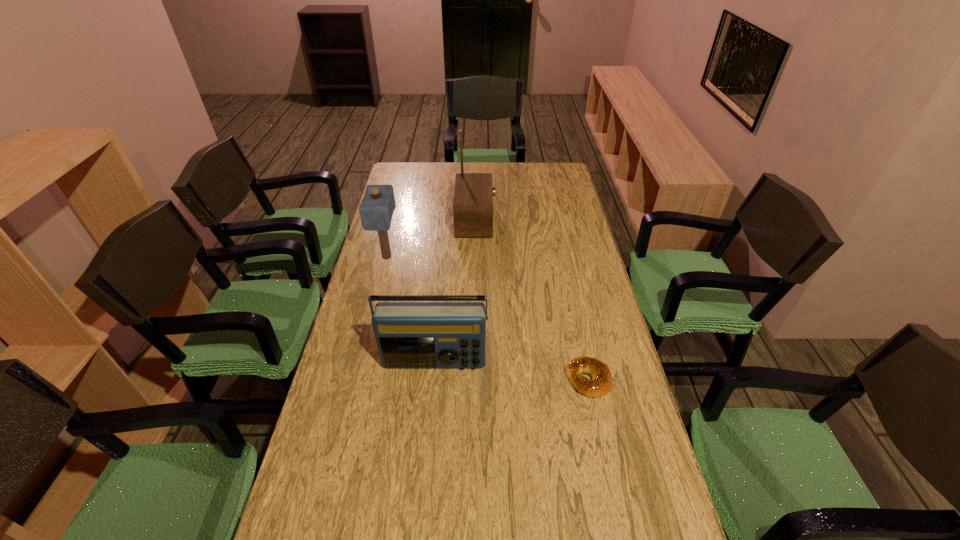
Locate an element on the screen. The image size is (960, 540). the farther radio receiver is located at coordinates (473, 197).

This screenshot has height=540, width=960. In order to click on the tallest object in this screenshot , I will do `click(473, 197)`.

Find the location of a particular element. Image resolution: width=960 pixels, height=540 pixels. the leftmost object is located at coordinates (376, 209).

At what (x,y) coordinates should I click in order to perform the action: click on mallet. Please return your answer as a coordinate pair (x, y). Looking at the image, I should click on (376, 209).

What are the coordinates of `the shorter radio receiver` in the screenshot? It's located at (408, 334).

The height and width of the screenshot is (540, 960). I want to click on bagel, so click(601, 383).

Where is `the rightmost object`? The height and width of the screenshot is (540, 960). the rightmost object is located at coordinates (x=601, y=383).

I want to click on vacant space positioned 0.360m on the front-facing side of the taller radio receiver, so click(x=581, y=220).

Locate an element on the screen. vacant space situated on the back of the mallet is located at coordinates (399, 206).

Image resolution: width=960 pixels, height=540 pixels. I want to click on free point located on the front panel of the shorter radio receiver, so click(x=420, y=517).